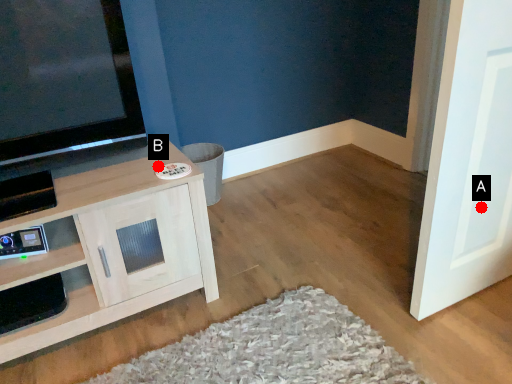
Question: Two points are circled on the image, labeled by A and B beside each circle. Which point appears farthest from the camera in this image?

Choices:
 (A) A is further
 (B) B is further

Answer: (B)